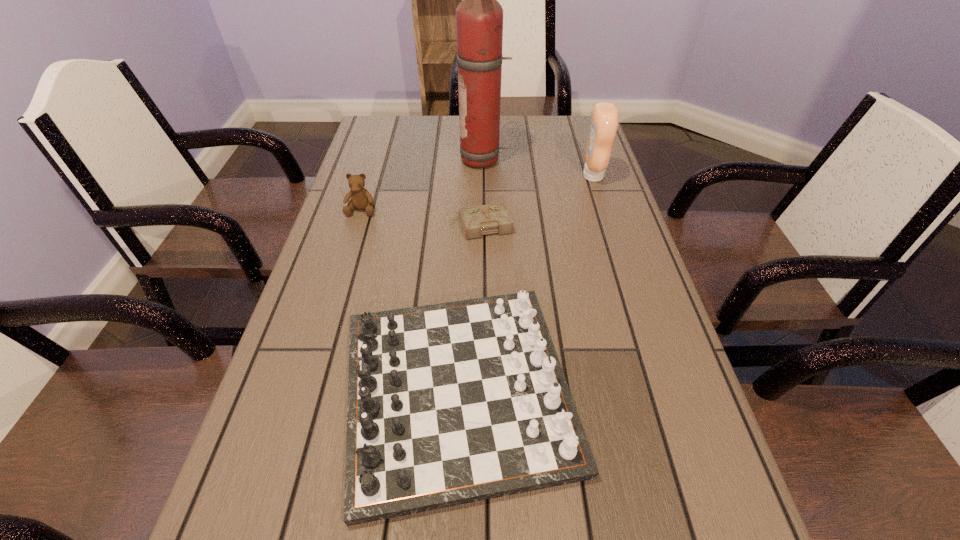
This screenshot has height=540, width=960. I want to click on free space at the left edge of the desktop, so click(254, 434).

In the image, there is a desktop. Where is `vacant space at the right edge`? vacant space at the right edge is located at coordinates (611, 198).

Identify the location of free space at the far left corner of the desktop. (378, 144).

Locate an element on the screen. This screenshot has height=540, width=960. vacant area that lies between the chessboard and the teddy bear is located at coordinates (410, 300).

Where is `free area in between the second tallest object and the diary`? free area in between the second tallest object and the diary is located at coordinates (537, 200).

What are the coordinates of `free space between the diary and the condiment` in the screenshot? It's located at (537, 200).

The width and height of the screenshot is (960, 540). I want to click on vacant region between the second tallest object and the fire extinguisher, so click(539, 168).

Identify the location of free space between the second tallest object and the leftmost object. This screenshot has height=540, width=960. (477, 192).

Locate an element on the screen. The height and width of the screenshot is (540, 960). vacant area between the diary and the teddy bear is located at coordinates (421, 217).

At what (x,y) coordinates should I click in order to perform the action: click on free area in between the fire extinguisher and the chessboard. Please return your answer as a coordinate pair (x, y). Image resolution: width=960 pixels, height=540 pixels. Looking at the image, I should click on (471, 275).